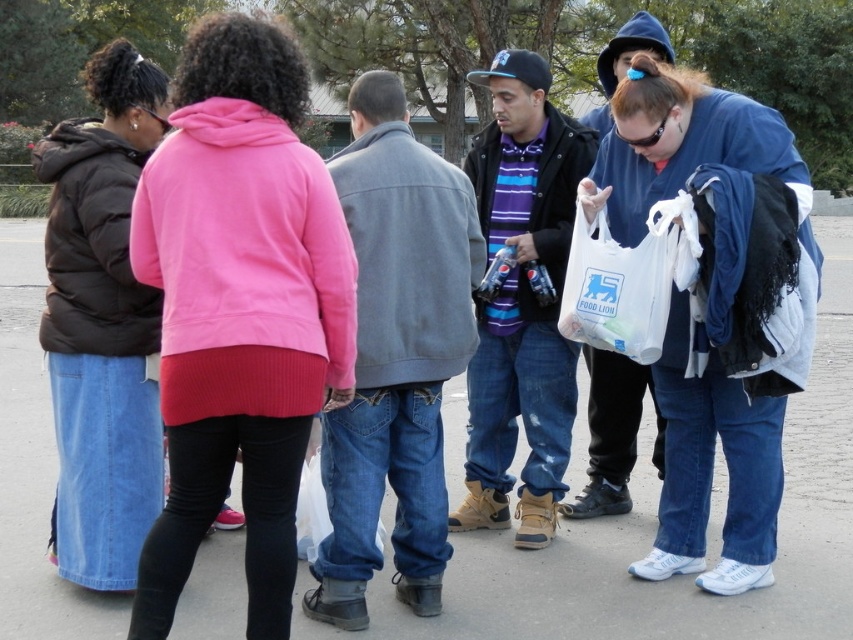
You are a photographer trying to capture a candid shot of the striped cotton shirt at center without the white plastic bag at center obstructing the view. Based on their positions, is this possible?

The white plastic bag at center is behind the striped cotton shirt at center, so the photographer can capture the striped cotton shirt at center without obstruction from the white plastic bag at center.

You are trying to decide whether to place a small item into the white plastic bag at center or wear the denim jeans at center. Based on their sizes, which one is more suitable for holding the item?

The white plastic bag at center is smaller than the denim jeans at center, so the item would fit better in the denim jeans at center.

You are a photographer trying to capture a candid shot of the striped cotton shirt at center without including the denim jeans at center in the frame. Based on their positions, is this possible?

The denim jeans at center are to the left of the striped cotton shirt at center, so if you position yourself to the right side of the striped cotton shirt at center, you can frame the shot to exclude the denim jeans at center.